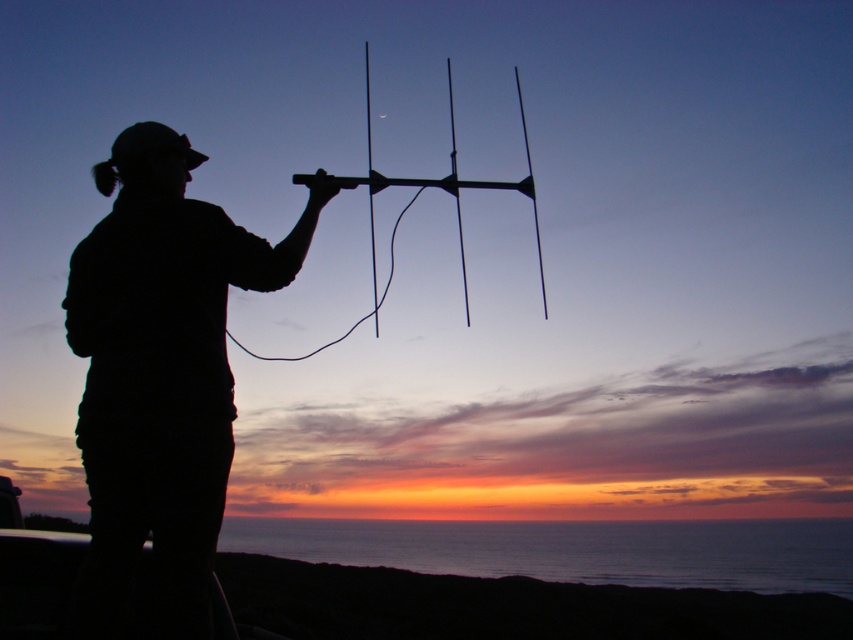
You are a photographer trying to capture the sunset. You notice the silhouette fabric at left and the black matte antenna at center in your frame. Which object should you adjust your focus on if you want to ensure the closest object is in sharp focus?

The silhouette fabric at left is closer to the viewer than the black matte antenna at center, so you should focus on the silhouette fabric at left to ensure it is in sharp focus.

You are a photographer trying to capture the sunset scene. You notice the silhouette fabric at left and the black matte antenna at center in your frame. Which object takes up more area in the photo?

The black matte antenna at center occupies more space than the silhouette fabric at left in the photo.

You are an engineer assessing the placement of the black matte antenna at center and the silhouette fabric at left. Given their widths, which object would require more horizontal space if you were to move them both to the right side of the frame?

The black matte antenna at center requires more horizontal space because it has a greater width than the silhouette fabric at left.